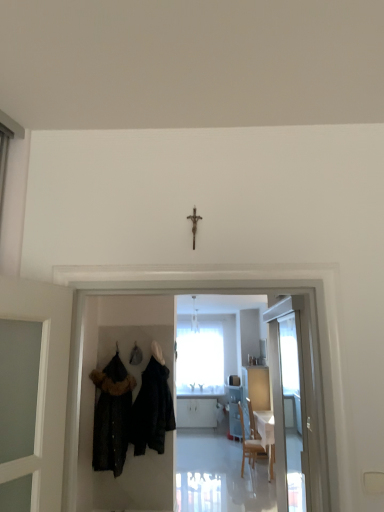
Question: Based on their sizes in the image, would you say white glossy door at right is bigger or smaller than velvet black coat at left, arranged as the second fancy dress when viewed from the right?

Choices:
 (A) small
 (B) big

Answer: (A)

Question: Considering the positions of white glossy door at right and velvet black coat at left, arranged as the second fancy dress when viewed from the right, in the image, is white glossy door at right taller or shorter than velvet black coat at left, arranged as the second fancy dress when viewed from the right,?

Choices:
 (A) tall
 (B) short

Answer: (B)

Question: Estimate the real-world distances between objects in this image. Which object is closer to the metallic crucifix at center?

Choices:
 (A) white glossy door at right
 (B) velvet black coat at left, arranged as the second fancy dress when viewed from the right
 (C) velvet black coat at center, which is counted as the second fancy dress, starting from the left

Answer: (C)

Question: Estimate the real-world distances between objects in this image. Which object is closer to the velvet black coat at center, which is counted as the second fancy dress, starting from the left?

Choices:
 (A) metallic crucifix at center
 (B) velvet black coat at left, which is counted as the 1th fancy dress, starting from the left
 (C) white glossy door at right

Answer: (B)